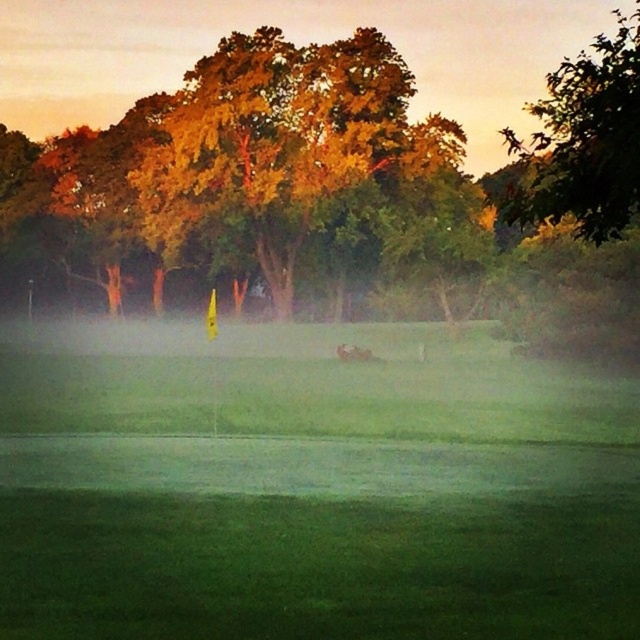
Is golden leafy tree at center below brown fuzzy dog at center?

No, golden leafy tree at center is not below brown fuzzy dog at center.

Which is more to the right, golden leafy tree at center or brown fuzzy dog at center?

brown fuzzy dog at center is more to the right.

The image size is (640, 640). Describe the element at coordinates (310, 179) in the screenshot. I see `golden leafy tree at center` at that location.

In order to click on golden leafy tree at center in this screenshot , I will do `click(310, 179)`.

Which of these two, green grassy field at center or green leafy tree at upper right, stands shorter?

With less height is green grassy field at center.

Which is more to the right, green grassy field at center or green leafy tree at upper right?

From the viewer's perspective, green leafy tree at upper right appears more on the right side.

Does point (474, 433) come farther from viewer compared to point (620, 129)?

Yes, it is behind point (620, 129).

Where is `green grassy field at center`? green grassy field at center is located at coordinates (310, 484).

In the scene shown: Is green grassy field at center shorter than golden leafy tree at center?

Correct, green grassy field at center is not as tall as golden leafy tree at center.

Can you confirm if green grassy field at center is taller than golden leafy tree at center?

In fact, green grassy field at center may be shorter than golden leafy tree at center.

Is point (346, 637) positioned behind point (420, 220)?

No, (346, 637) is closer to viewer.

Where is `green grassy field at center`? green grassy field at center is located at coordinates (310, 484).